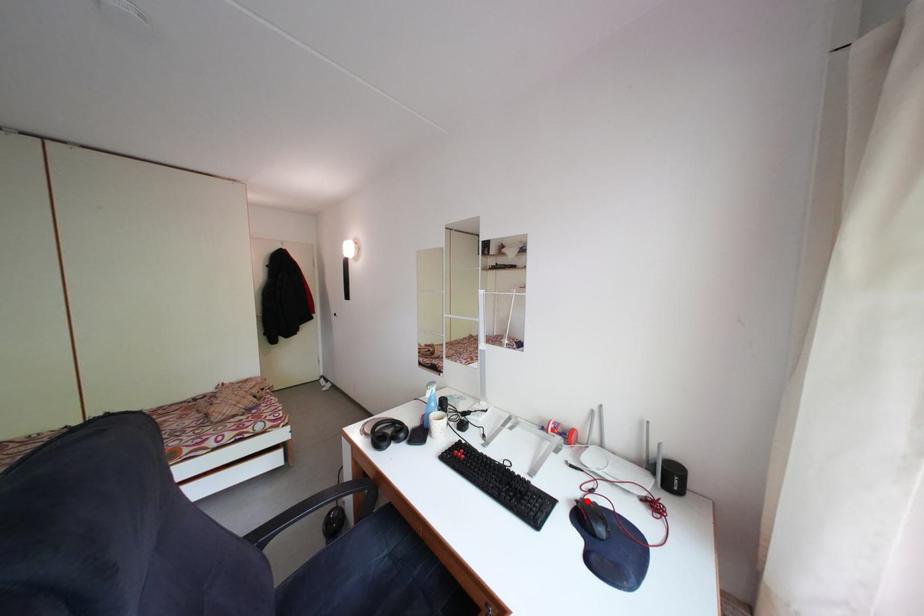
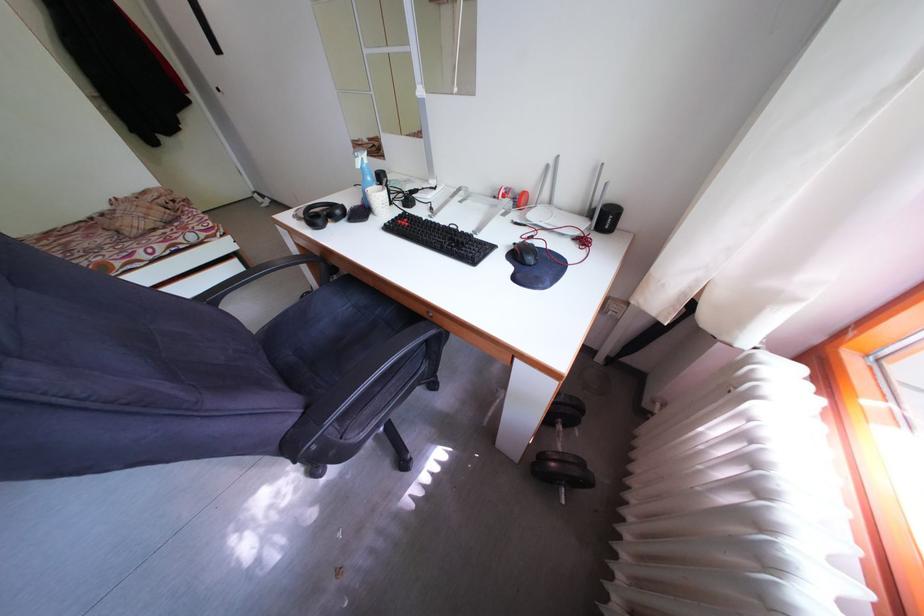
In the second image, find the point that corresponds to the highlighted location in the first image.

(527, 246)